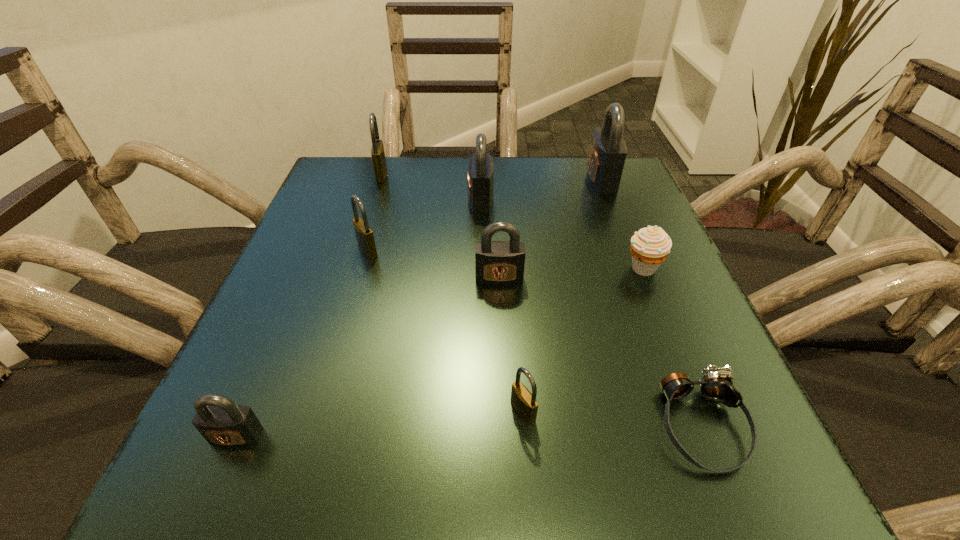
I want to click on the biggest gray padlock, so click(x=608, y=152).

Identify the location of the rightmost gray padlock. (608, 152).

Where is `the second biggest gray padlock`? Image resolution: width=960 pixels, height=540 pixels. the second biggest gray padlock is located at coordinates (480, 177).

Find the location of `the biggest brass padlock`. the biggest brass padlock is located at coordinates (377, 150).

In order to click on the second nearest gray padlock in this screenshot , I will do `click(497, 262)`.

I want to click on the second smallest gray padlock, so click(497, 262).

Locate an element on the screen. the second biggest brass padlock is located at coordinates (364, 234).

At what (x,y) coordinates should I click in order to perform the action: click on the fourth nearest padlock. Please return your answer as a coordinate pair (x, y). Looking at the image, I should click on (364, 234).

Locate an element on the screen. Image resolution: width=960 pixels, height=540 pixels. muffin is located at coordinates (650, 246).

You are a GUI agent. You are given a task and a screenshot of the screen. Output one action in this format:
    pyautogui.click(x=<x>, y=<y>)
    Task: Click on the nearest brass padlock
    Image resolution: width=960 pixels, height=540 pixels.
    Given the screenshot: What is the action you would take?
    pyautogui.click(x=524, y=403)